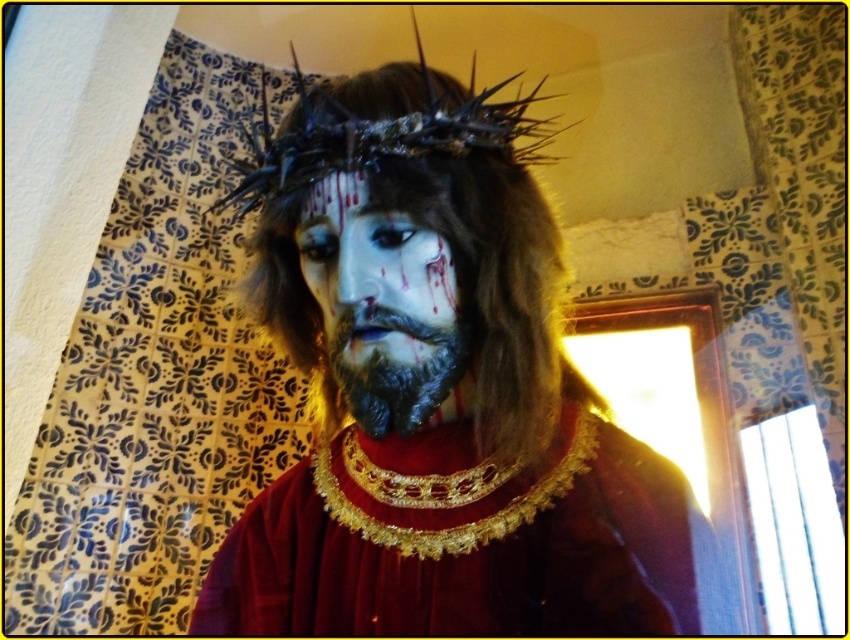
Question: Which of the following is the closest to the observer?

Choices:
 (A) (344, 186)
 (B) (446, 333)
 (C) (378, 141)
 (D) (344, 384)

Answer: (C)

Question: Which point appears closest to the camera in this image?

Choices:
 (A) click(x=299, y=612)
 (B) click(x=528, y=163)
 (C) click(x=246, y=278)
 (D) click(x=323, y=202)

Answer: (D)

Question: Is gold textured necklace at center wider than matte black forehead at center?

Choices:
 (A) yes
 (B) no

Answer: (A)

Question: Is matte black face at center positioned at the back of matte black forehead at center?

Choices:
 (A) no
 (B) yes

Answer: (A)

Question: Which point is closer to the camera?

Choices:
 (A) (383, 211)
 (B) (261, 308)

Answer: (A)

Question: Is dark metallic crown at center in front of matte black forehead at center?

Choices:
 (A) no
 (B) yes

Answer: (B)